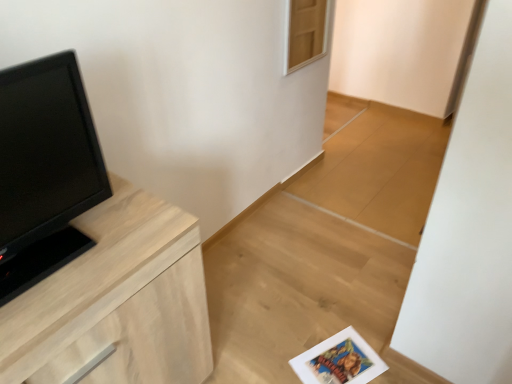
Locate an element on the screen. The width and height of the screenshot is (512, 384). vacant space in front of black matte tv at left is located at coordinates coord(52,302).